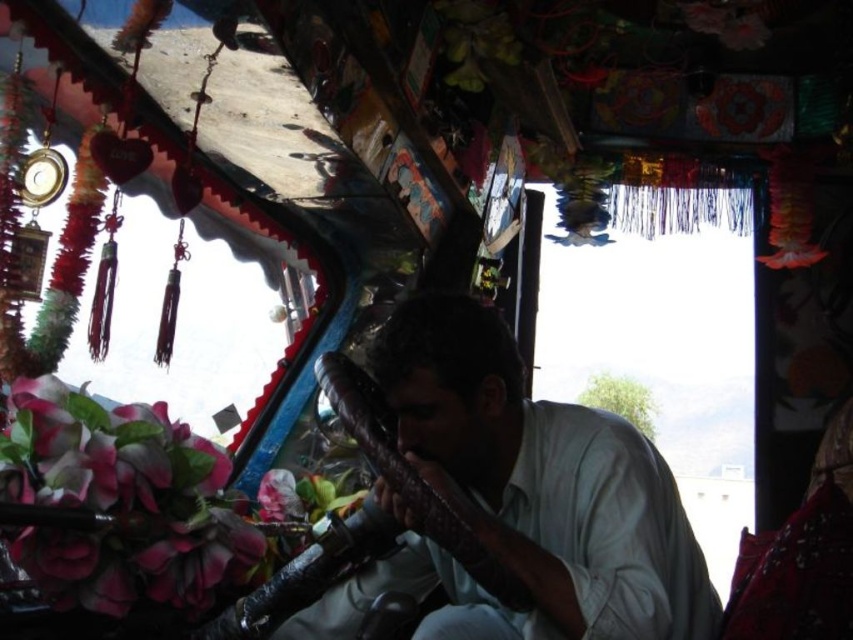
Question: Does matte brown instrument at center lie behind pink silk flower at lower left?

Choices:
 (A) yes
 (B) no

Answer: (A)

Question: Is matte brown instrument at center in front of pink silk flower at lower left?

Choices:
 (A) no
 (B) yes

Answer: (A)

Question: Among these points, which one is farthest from the camera?

Choices:
 (A) (78, 589)
 (B) (676, 577)

Answer: (B)

Question: Is matte brown instrument at center bigger than pink silk flower at lower left?

Choices:
 (A) yes
 (B) no

Answer: (A)

Question: Among these points, which one is farthest from the camera?

Choices:
 (A) (639, 605)
 (B) (109, 476)

Answer: (B)

Question: Which object is closer to the camera taking this photo?

Choices:
 (A) matte brown instrument at center
 (B) pink silk flower at lower left

Answer: (B)